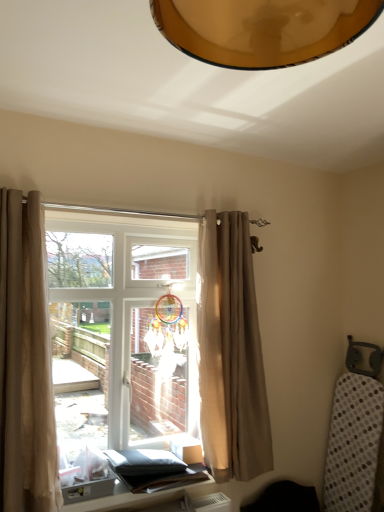
Question: In the image, is translucent glass window at center positioned in front of or behind beige fabric curtain at center, which appears as the 1th curtain when viewed from the right?

Choices:
 (A) behind
 (B) front

Answer: (B)

Question: Does point (178, 284) appear closer or farther from the camera than point (236, 263)?

Choices:
 (A) farther
 (B) closer

Answer: (A)

Question: Which of these objects is positioned closest to the beige fabric curtain at center, acting as the 2th curtain starting from the left?

Choices:
 (A) translucent glass window at center
 (B) matte black table at lower center
 (C) beige fabric curtain at left, the 2th curtain from the back

Answer: (A)

Question: Considering the real-world distances, which object is farthest from the translucent glass window at center?

Choices:
 (A) matte black table at lower center
 (B) beige fabric curtain at center, which ranks as the 2th curtain in front-to-back order
 (C) beige fabric curtain at left, the 1th curtain positioned from the left

Answer: (A)